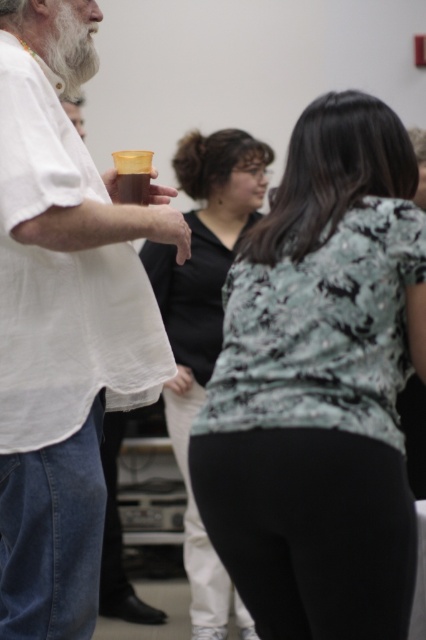
Question: Is floral-patterned blouse at center above white matte shirt at upper left?

Choices:
 (A) no
 (B) yes

Answer: (A)

Question: Which object is closer to the camera taking this photo?

Choices:
 (A) floral-patterned blouse at center
 (B) black matte shirt at center
 (C) white matte shirt at upper left

Answer: (A)

Question: Which object is positioned closest to the floral-patterned blouse at center?

Choices:
 (A) white matte shirt at upper left
 (B) black matte shirt at center

Answer: (A)

Question: Does floral-patterned blouse at center have a greater width compared to black matte shirt at center?

Choices:
 (A) yes
 (B) no

Answer: (B)

Question: Which is nearer to the floral-patterned blouse at center?

Choices:
 (A) white matte shirt at upper left
 (B) black matte shirt at center

Answer: (A)

Question: Is floral-patterned blouse at center smaller than black matte shirt at center?

Choices:
 (A) no
 (B) yes

Answer: (B)